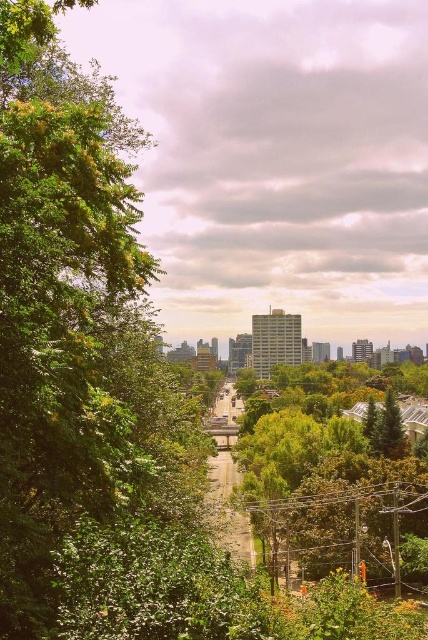
You are standing at the center of the paved road and want to take a photo of the green leafy tree at left. In which direction should you point your camera to capture the tree in the frame?

The green leafy tree at left is located to the left side of the scene, so you should point your camera to the left to capture it in the frame.

You are standing on the paved road in the center of the image. Looking towards the left side, you see the green leafy tree at left and the green leafy tree at center. Which tree is positioned higher in the image?

The green leafy tree at left is positioned higher in the image than the green leafy tree at center.